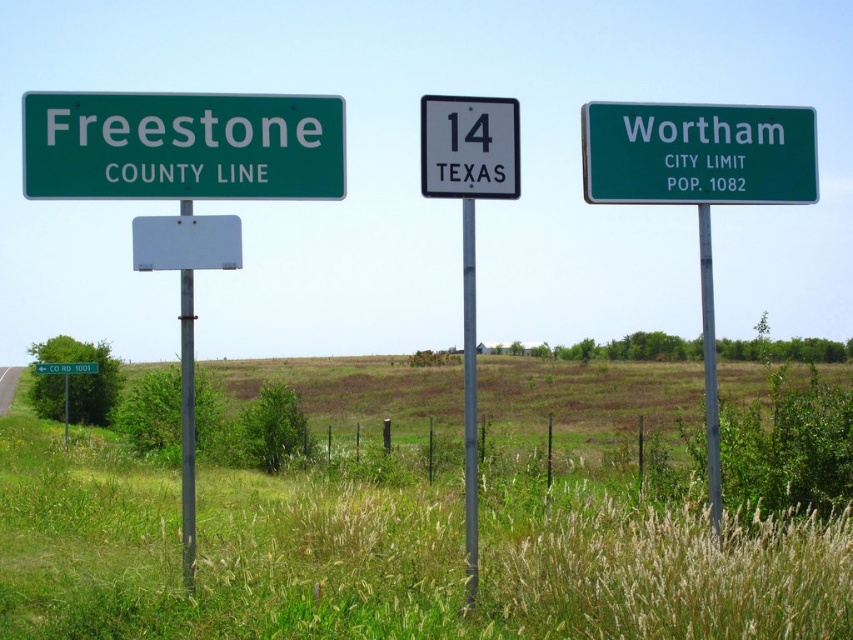
Does green matte freestone county line at left appear over green plastic sign at center?

Correct, green matte freestone county line at left is located above green plastic sign at center.

Is point (248, 106) more distant than point (38, 369)?

That is False.

I want to click on green matte freestone county line at left, so click(183, 145).

Looking at this image, does green matte freestone county line at left have a lesser width compared to metallic pole at center?

No.

Who is more forward, (x=125, y=116) or (x=463, y=509)?

Point (x=125, y=116) is in front.

Which is behind, point (56, 192) or point (473, 244)?

Point (473, 244)

What are the coordinates of `green matte freestone county line at left` in the screenshot? It's located at (183, 145).

Is green matte sign at right further to camera compared to metallic gray pole at right?

Yes, it is.

Can you confirm if green matte sign at right is shorter than metallic gray pole at right?

Yes, green matte sign at right is shorter than metallic gray pole at right.

Does point (672, 140) lie behind point (705, 406)?

No, it is in front of (705, 406).

The width and height of the screenshot is (853, 640). I want to click on green matte sign at right, so click(x=697, y=154).